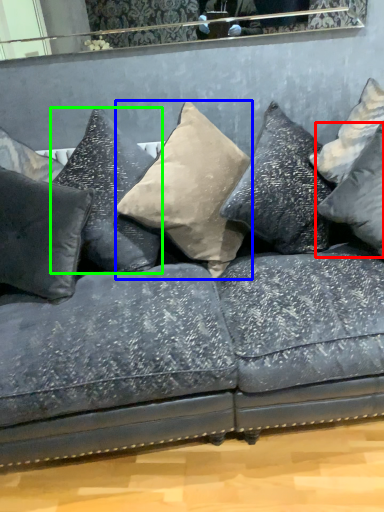
Question: Estimate the real-world distances between objects in this image. Which object is closer to pillow (highlighted by a red box), pillow (highlighted by a blue box) or pillow (highlighted by a green box)?

Choices:
 (A) pillow
 (B) pillow

Answer: (A)